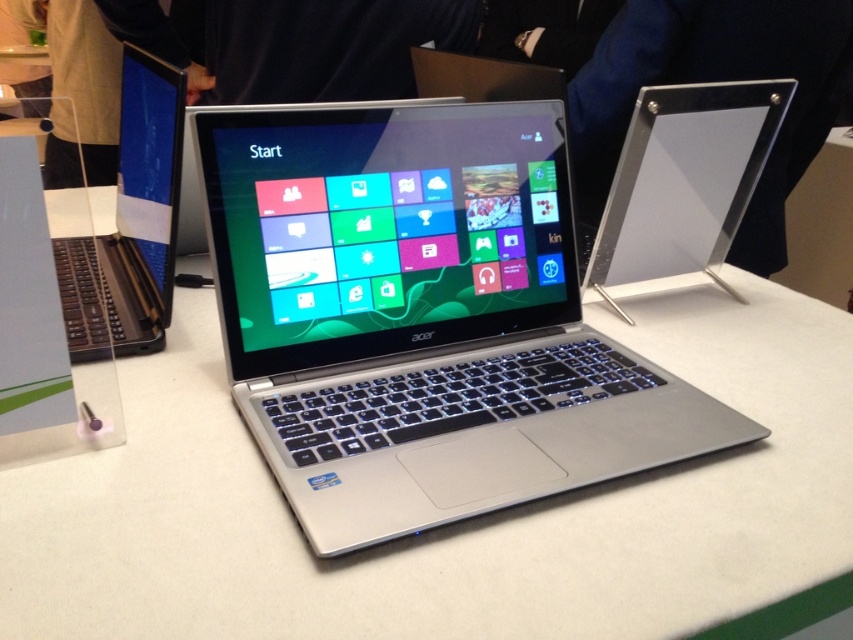
Question: Among these objects, which one is farthest from the camera?

Choices:
 (A) satin black laptop at left
 (B) white matte counter top at center

Answer: (A)

Question: In this image, where is white matte counter top at center located relative to satin black laptop at left?

Choices:
 (A) right
 (B) left

Answer: (A)

Question: Does white matte counter top at center lie in front of satin black laptop at left?

Choices:
 (A) yes
 (B) no

Answer: (A)

Question: Can you confirm if white matte counter top at center is positioned to the right of silver metallic laptop at center?

Choices:
 (A) yes
 (B) no

Answer: (A)

Question: Which point is farther from the camera taking this photo?

Choices:
 (A) (424, 445)
 (B) (73, 248)
 (C) (851, 420)

Answer: (B)

Question: Estimate the real-world distances between objects in this image. Which object is closer to the silver metallic laptop at center?

Choices:
 (A) satin black laptop at left
 (B) white matte counter top at center

Answer: (B)